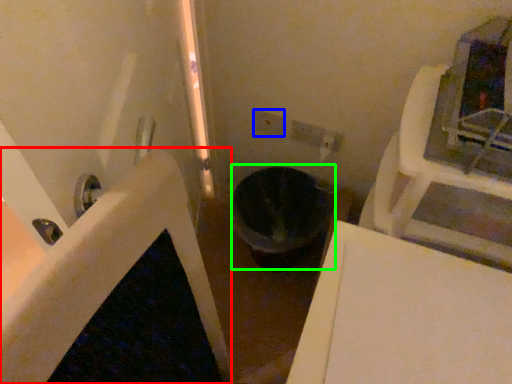
Question: Which object is positioned closest to bath (highlighted by a red box)? Select from electric outlet (highlighted by a blue box) and toilet bowl (highlighted by a green box).

Choices:
 (A) electric outlet
 (B) toilet bowl

Answer: (B)